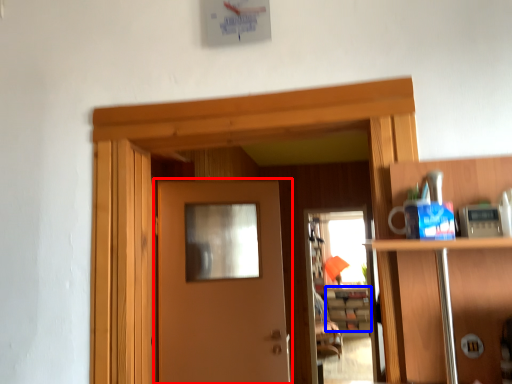
Question: Which object appears farthest to the camera in this image, door (highlighted by a red box) or cabinetry (highlighted by a blue box)?

Choices:
 (A) door
 (B) cabinetry

Answer: (B)